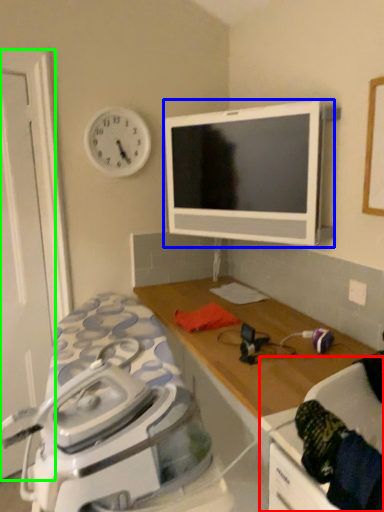
Question: Based on their relative distances, which object is nearer to swivel chair (highlighted by a red box)? Choose from television (highlighted by a blue box) and door (highlighted by a green box).

Choices:
 (A) television
 (B) door

Answer: (A)